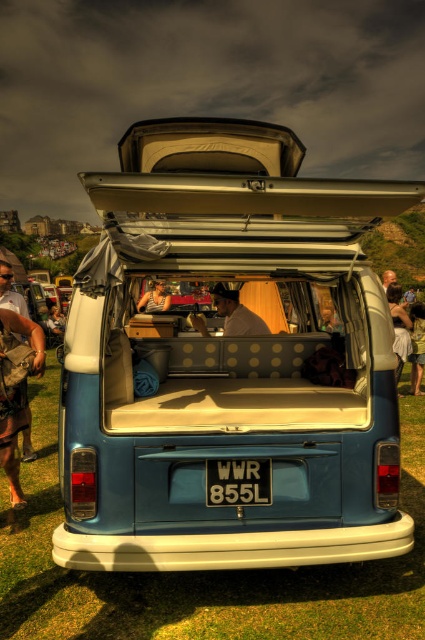
You are standing behind the vintage Volkswagen camper van and want to place a small decoration between the two points marked as point (x=5, y=323) and point (x=402, y=340). Since you want it to be closer to the van, where should you place it?

You should place the decoration closer to point (x=5, y=323) because it is in front of point (x=402, y=340), meaning it is nearer to the van.